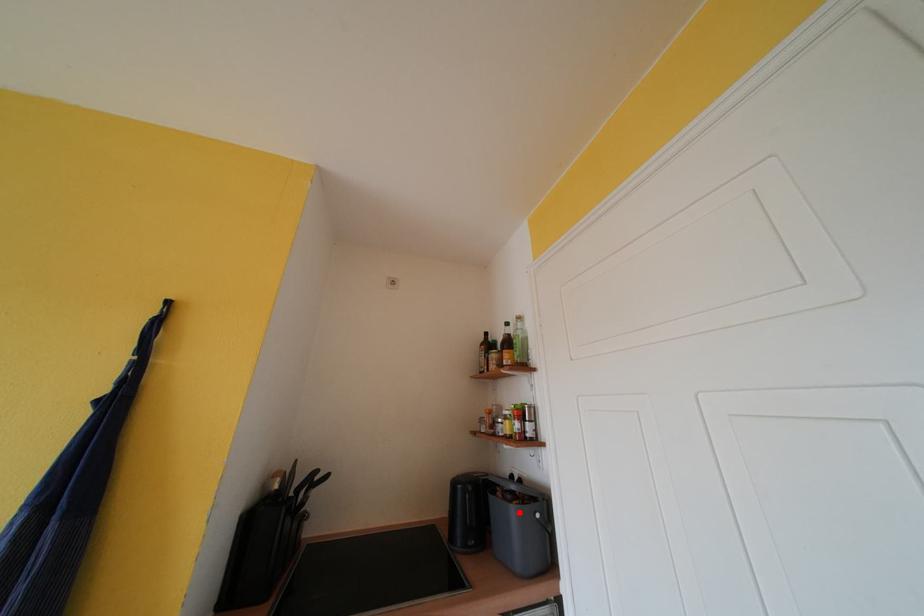
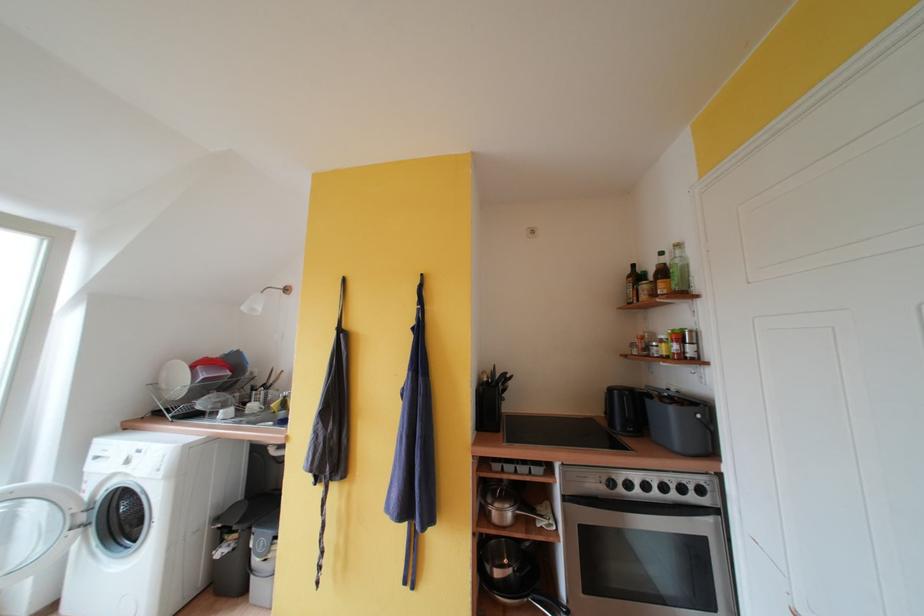
Find the pixel in the second image that matches the highlighted location in the first image.

(678, 413)